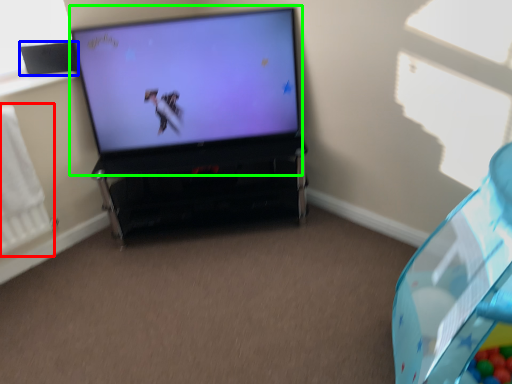
Question: Considering the real-world distances, which object is closest to radiator (highlighted by a red box)? speaker (highlighted by a blue box) or television (highlighted by a green box).

Choices:
 (A) speaker
 (B) television

Answer: (A)